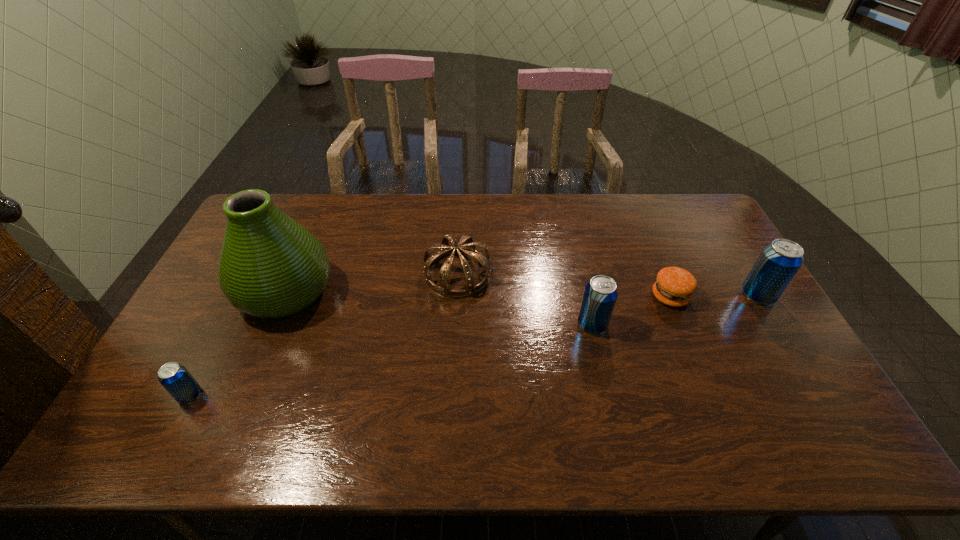
The width and height of the screenshot is (960, 540). What are the coordinates of `vacant space in between the tallest object and the fifth tallest object` in the screenshot? It's located at (238, 343).

The height and width of the screenshot is (540, 960). I want to click on free point between the second beer can from left to right and the rightmost beer can, so click(675, 310).

This screenshot has height=540, width=960. In order to click on vacant area that lies between the second farthest beer can and the nearest beer can in this screenshot , I will do `click(391, 360)`.

Identify the location of vacant space that is in between the leftmost beer can and the tiara. This screenshot has height=540, width=960. (324, 334).

Where is `unoccupied area between the third object from left to right and the second beer can from right to left`? Image resolution: width=960 pixels, height=540 pixels. unoccupied area between the third object from left to right and the second beer can from right to left is located at coordinates (525, 299).

Locate an element on the screen. The image size is (960, 540). empty space between the third object from right to left and the rightmost beer can is located at coordinates (675, 310).

Choose which object is the nearest neighbor to the second beer can from left to right. Please provide its 2D coordinates. Your answer should be formatted as a tuple, i.e. [(x, y)], where the tuple contains the x and y coordinates of a point satisfying the conditions above.

[(674, 286)]

Image resolution: width=960 pixels, height=540 pixels. Identify the location of object that stands as the closest to the fifth tallest object. (270, 266).

Locate an element on the screen. The width and height of the screenshot is (960, 540). beer can that stands as the closest to the shortest beer can is located at coordinates (600, 294).

Point out which beer can is positioned as the second nearest to the leftmost beer can. Please provide its 2D coordinates. Your answer should be formatted as a tuple, i.e. [(x, y)], where the tuple contains the x and y coordinates of a point satisfying the conditions above.

[(779, 261)]